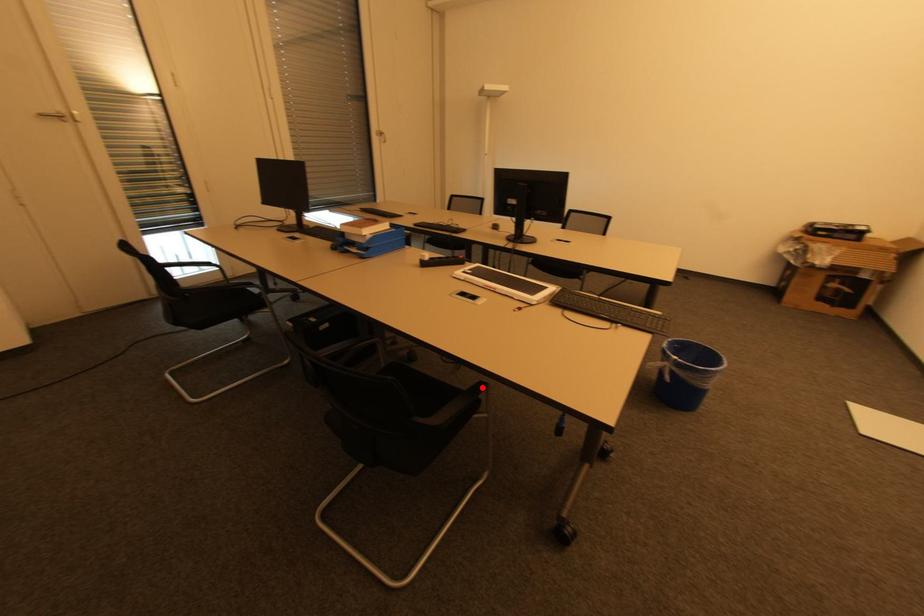
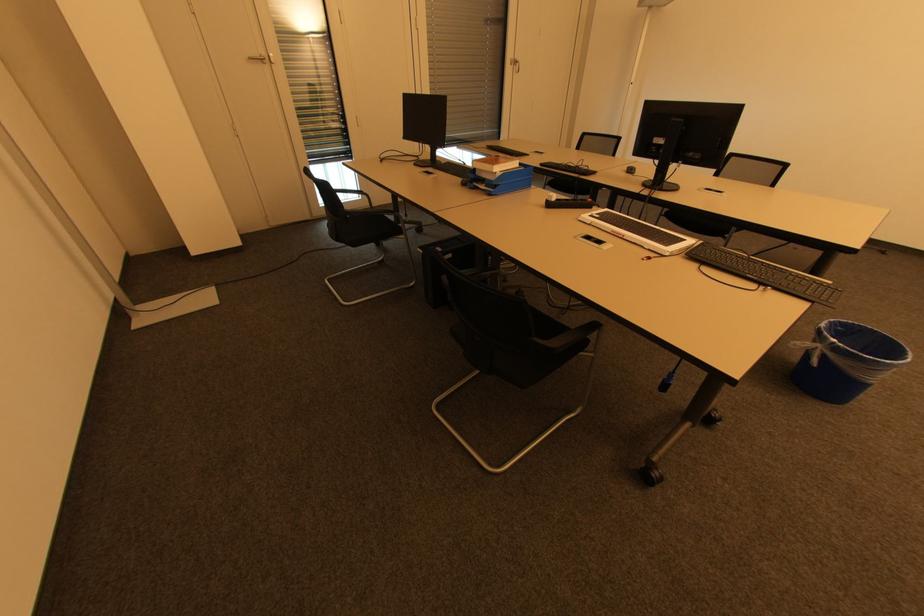
Question: I am providing you with two images of the same scene from different viewpoints. A red point is shown in image1. For the corresponding object point in image2, is it positioned nearer or farther from the camera?

Choices:
 (A) Nearer
 (B) Farther

Answer: (A)